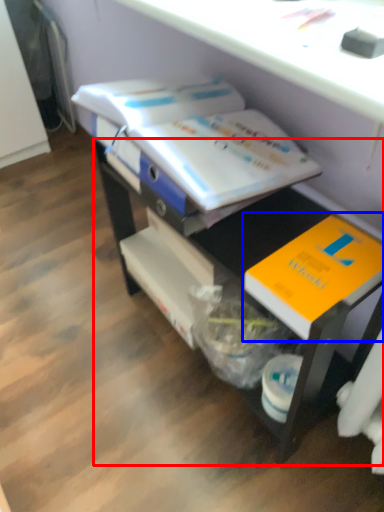
Question: Among these objects, which one is farthest to the camera, desk (highlighted by a red box) or book (highlighted by a blue box)?

Choices:
 (A) desk
 (B) book

Answer: (B)